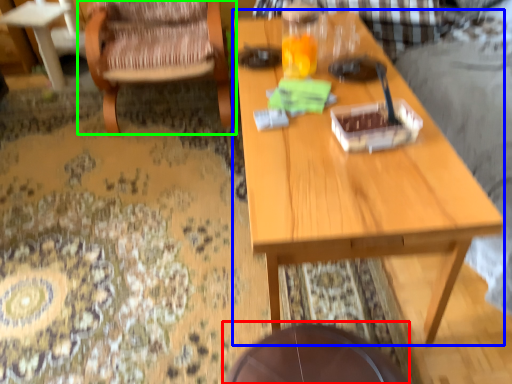
Question: Which object is the closest to the round table (highlighted by a red box)? Choose among these: table (highlighted by a blue box) or chair (highlighted by a green box).

Choices:
 (A) table
 (B) chair

Answer: (A)